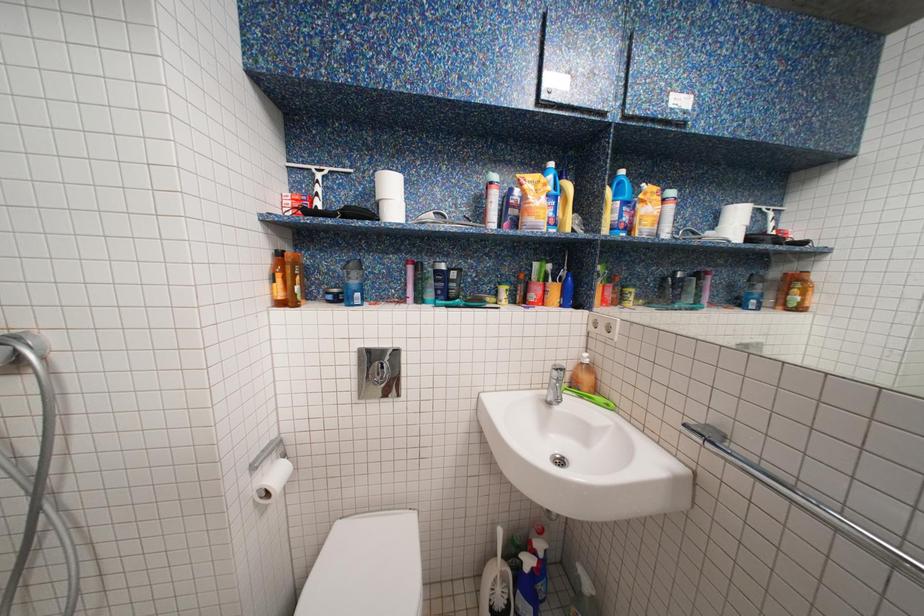
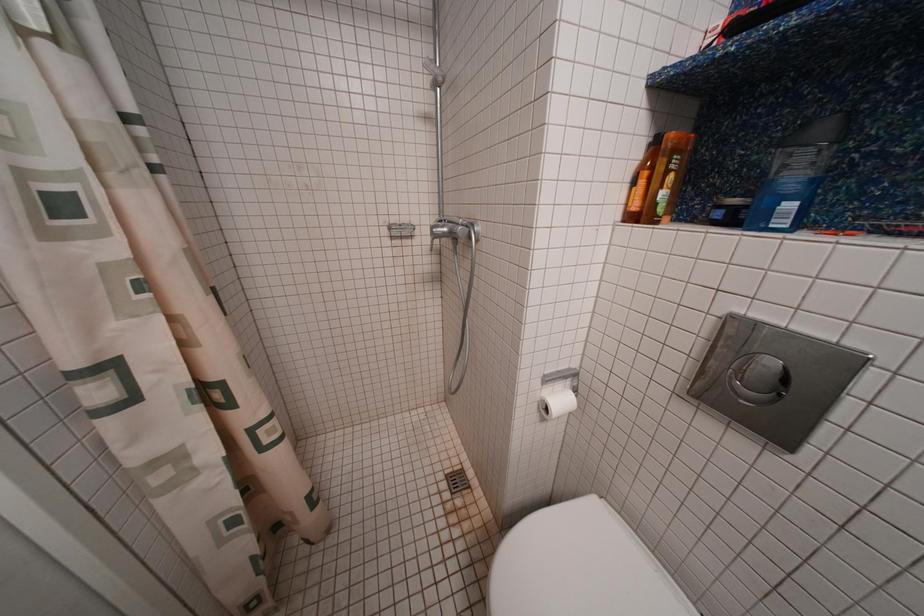
The images are taken continuously from a first-person perspective. In which direction is your viewpoint rotating?

The rotation direction of the camera is left-down.